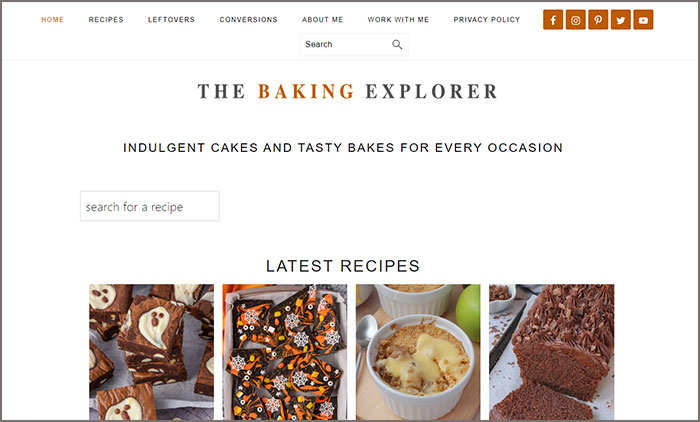
I want to click on pictures, so click(x=507, y=344), click(x=411, y=320), click(x=308, y=320), click(x=182, y=335).